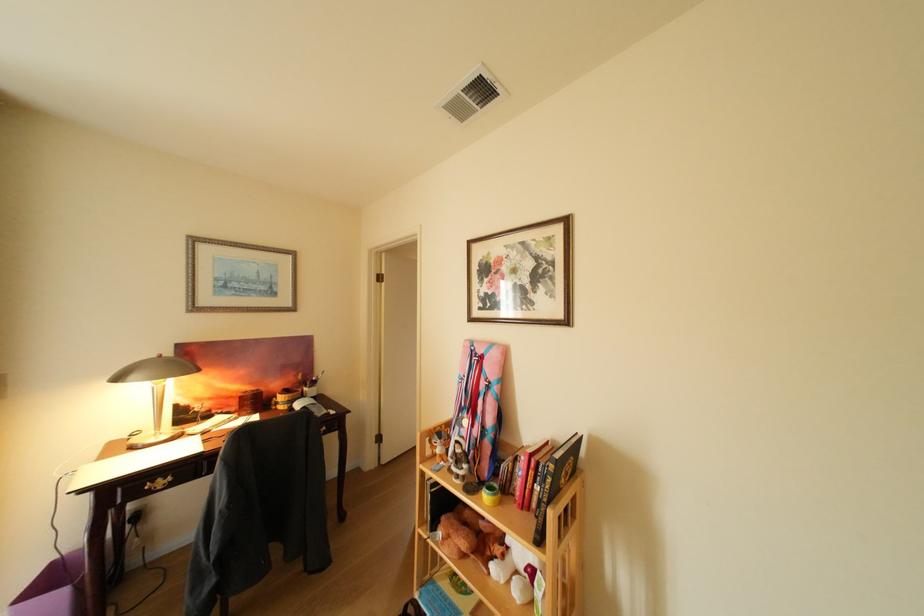
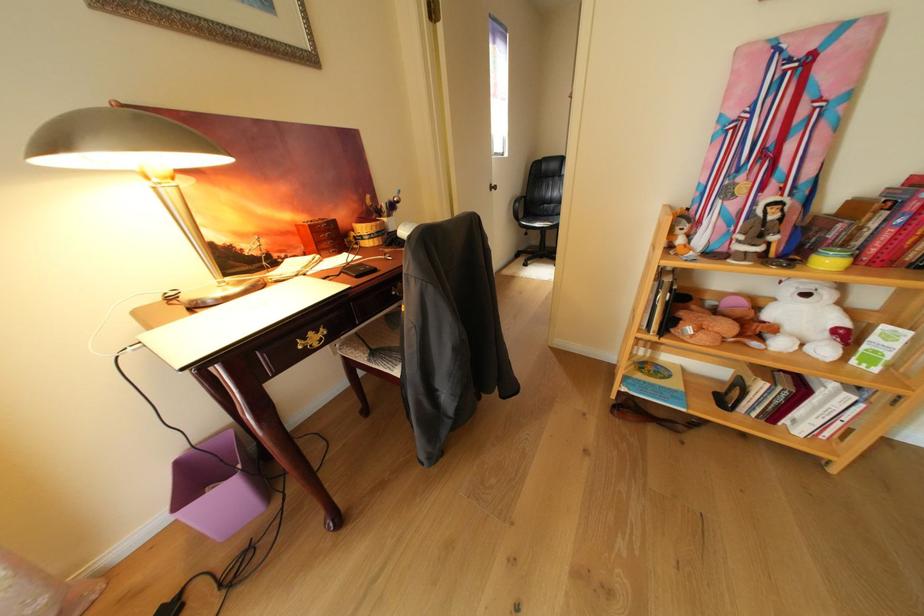
Find the pixel in the second image that matches (160,490) in the first image.

(312, 349)